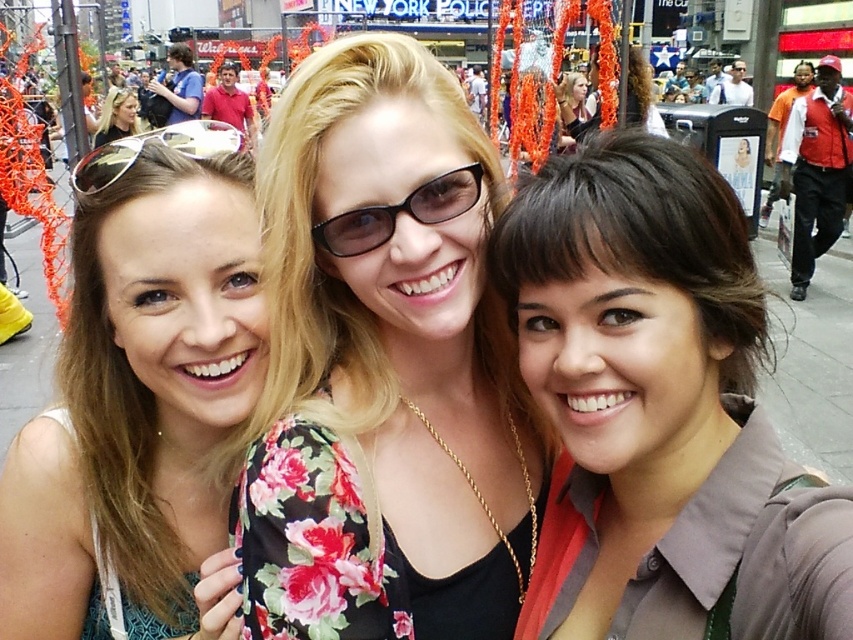
Question: Is silver reflective sunglasses at upper left positioned behind matte black sunglasses at upper center?

Choices:
 (A) no
 (B) yes

Answer: (A)

Question: Estimate the real-world distances between objects in this image. Which object is farther from the silver reflective sunglasses at upper left?

Choices:
 (A) matte black sunglasses at center
 (B) floral fabric dress at center
 (C) brown hair at center

Answer: (C)

Question: Among these objects, which one is nearest to the camera?

Choices:
 (A) floral fabric dress at center
 (B) matte black sunglasses at upper left
 (C) silver reflective sunglasses at upper left

Answer: (A)

Question: Does matte black sunglasses at center appear over silver reflective sunglasses at upper left?

Choices:
 (A) yes
 (B) no

Answer: (B)

Question: Does floral fabric dress at center lie in front of matte black sunglasses at upper center?

Choices:
 (A) no
 (B) yes

Answer: (B)

Question: Estimate the real-world distances between objects in this image. Which object is closer to the brown hair at center?

Choices:
 (A) matte black sunglasses at center
 (B) matte black sunglasses at upper center
 (C) matte black sunglasses at upper left

Answer: (A)